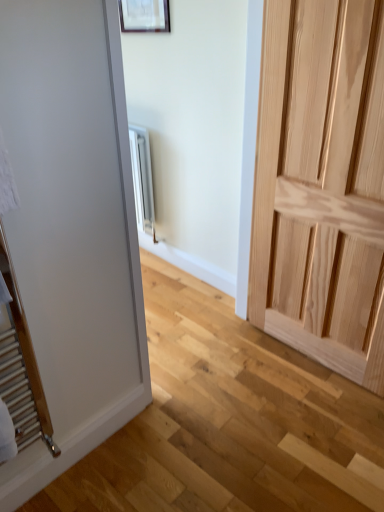
What do you see at coordinates (321, 184) in the screenshot? This screenshot has width=384, height=512. I see `natural wood door at right` at bounding box center [321, 184].

Where is `natural wood door at right`? The image size is (384, 512). natural wood door at right is located at coordinates (321, 184).

Find the location of a particular element. The width and height of the screenshot is (384, 512). natural wood door at right is located at coordinates (321, 184).